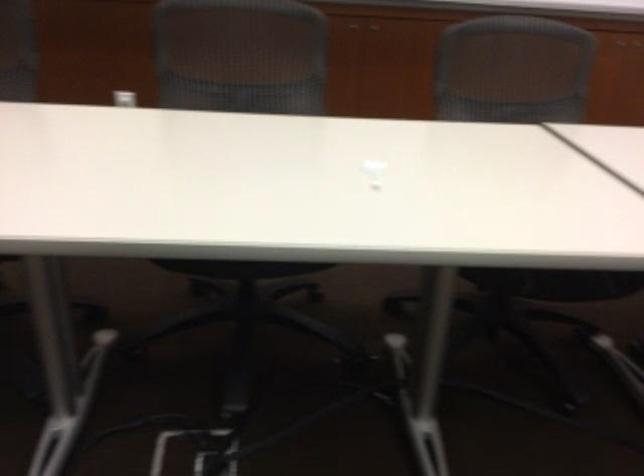
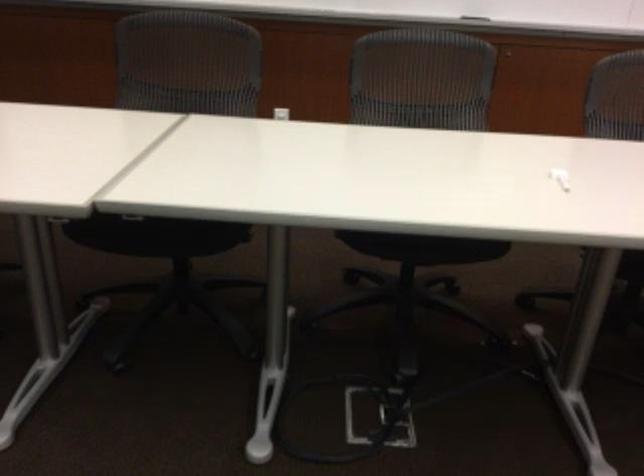
In a continuous first-person perspective shot, in which direction is the camera moving?

→ The cameraman walked toward left, backward.